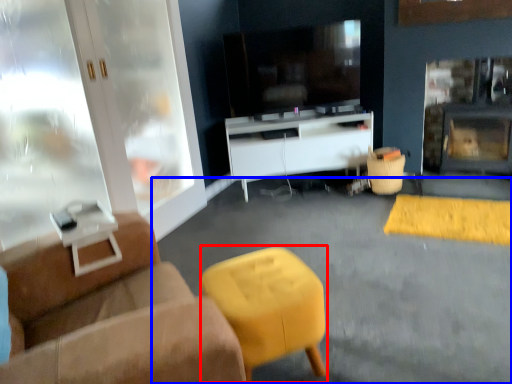
Question: Which point is further to the camera, bar stool (highlighted by a red box) or concrete (highlighted by a blue box)?

Choices:
 (A) bar stool
 (B) concrete

Answer: (A)